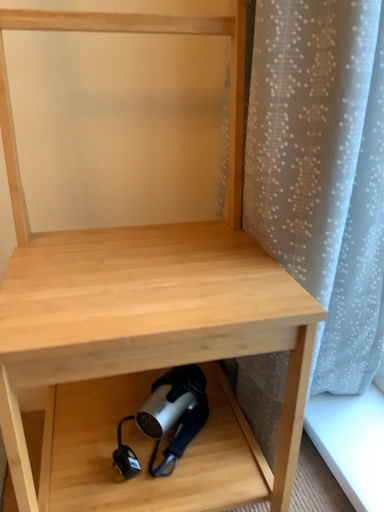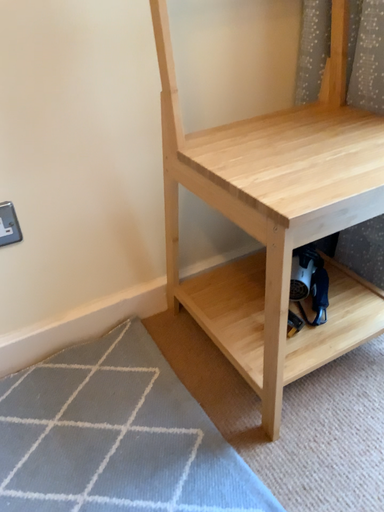
Question: Which way did the camera rotate in the video?

Choices:
 (A) rotated downward
 (B) rotated upward

Answer: (A)